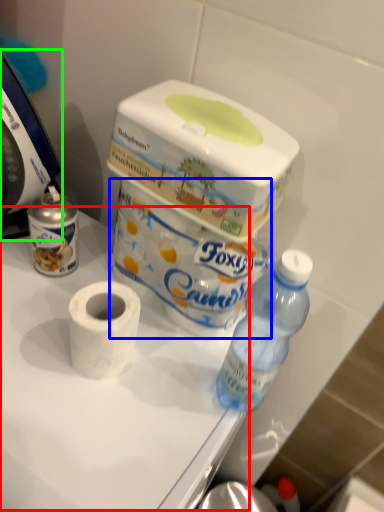
Question: Estimate the real-world distances between objects in this image. Which object is closer to table (highlighted by a red box), toilet paper (highlighted by a blue box) or food processor (highlighted by a green box)?

Choices:
 (A) toilet paper
 (B) food processor

Answer: (A)